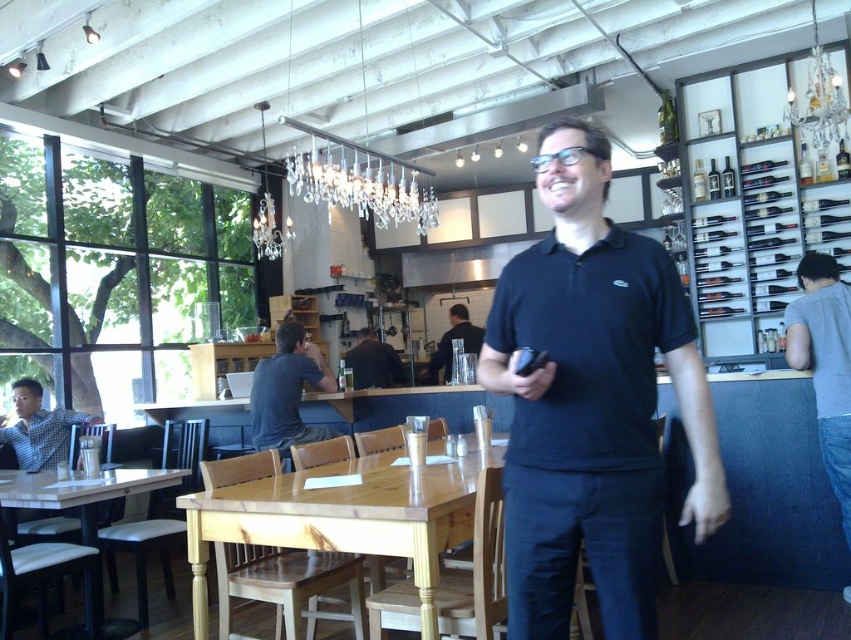
Question: Can you confirm if dark gray shirt at center is wider than matte black shirt at center?

Choices:
 (A) no
 (B) yes

Answer: (A)

Question: Which object appears farthest from the camera in this image?

Choices:
 (A) dark blue shirt at center
 (B) gray cotton polo shirt at right
 (C) matte black shirt at center
 (D) gray cotton shirt at right

Answer: (C)

Question: Does wooden table at lower left appear on the left side of gray cotton polo shirt at right?

Choices:
 (A) no
 (B) yes

Answer: (B)

Question: Is crystal glass chandelier at upper center wider than dark gray shirt at center?

Choices:
 (A) yes
 (B) no

Answer: (A)

Question: Among these points, which one is nearest to the camera?

Choices:
 (A) (624, 228)
 (B) (820, 410)
 (C) (358, 168)
 (D) (804, 272)

Answer: (B)

Question: Considering the real-world distances, which object is closest to the crystal glass chandelier at upper center?

Choices:
 (A) matte black shirt at center
 (B) dark blue shirt at center
 (C) natural wood table at center
 (D) gray cotton shirt at right

Answer: (B)